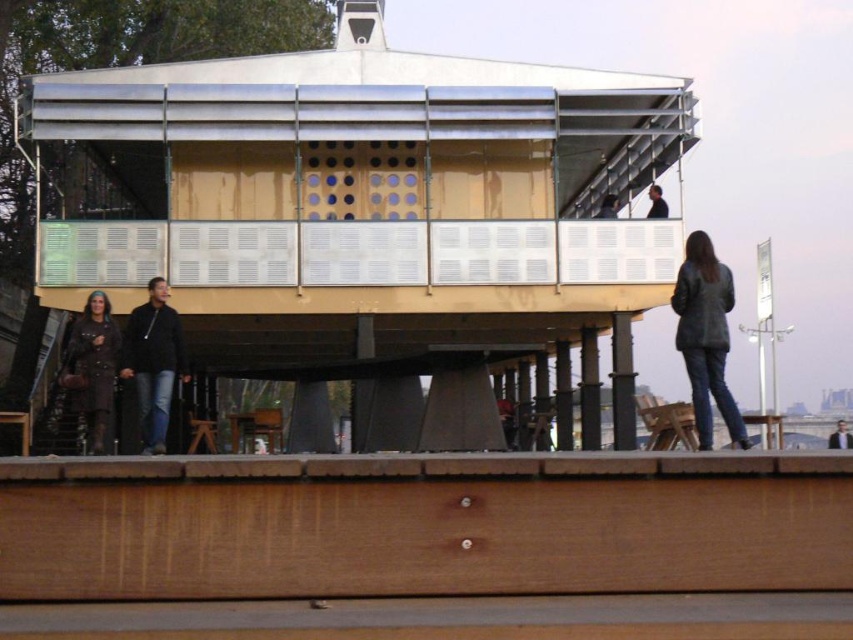
You are a fashion designer observing the modern architectural structure. You notice a leather jacket at right and a black leather jacket at upper right. Which of these two jackets has a greater width?

The leather jacket at right might be wider than black leather jacket at upper right.

You are a fashion designer observing the modern architectural structure. You notice a leather jacket at right and a brown leather coat at lower left. Which item of clothing has a smaller width?

The leather jacket at right has a smaller width than the brown leather coat at lower left according to the description.